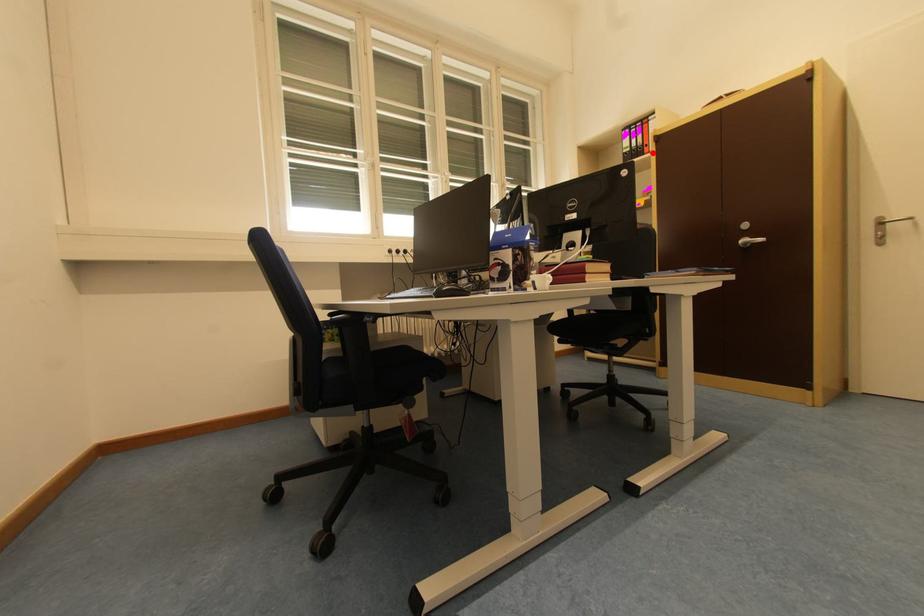
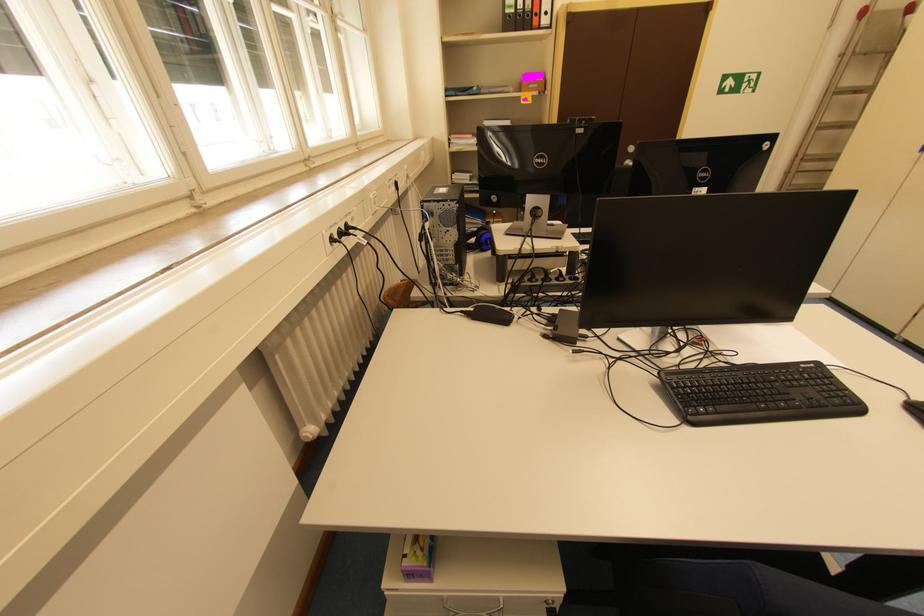
Find the pixel in the second image that matches the highlighted location in the first image.

(541, 25)